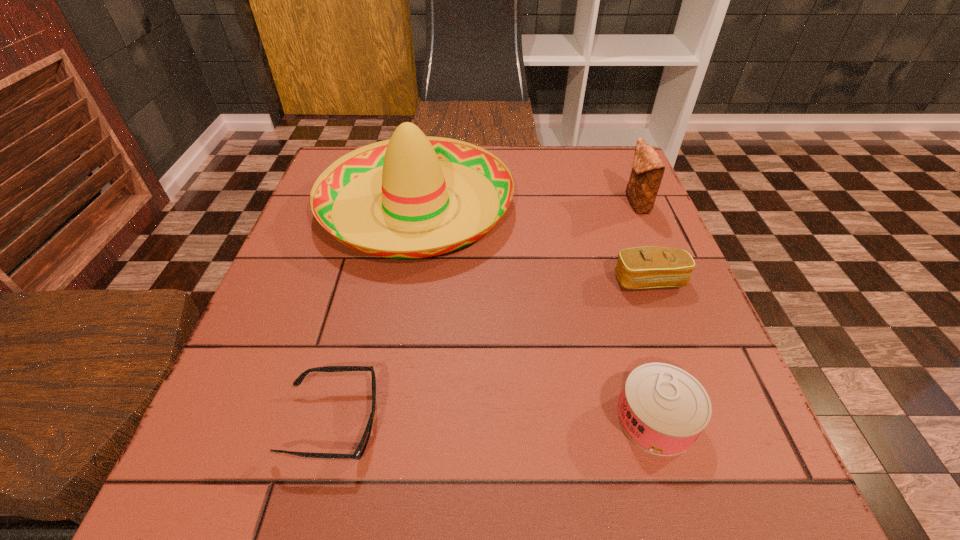
At what (x,y) coordinates should I click in order to perform the action: click on object at the far left corner. Please return your answer as a coordinate pair (x, y). Looking at the image, I should click on (x=414, y=173).

The width and height of the screenshot is (960, 540). I want to click on object present at the near left corner, so click(359, 452).

Locate an element on the screen. object positioned at the far right corner is located at coordinates (647, 172).

The height and width of the screenshot is (540, 960). I want to click on object that is at the near right corner, so click(x=663, y=409).

Image resolution: width=960 pixels, height=540 pixels. Identify the location of vacant space at the far edge. (567, 164).

In the image, there is a desktop. Where is `free region at the left edge`? This screenshot has height=540, width=960. free region at the left edge is located at coordinates (285, 257).

Image resolution: width=960 pixels, height=540 pixels. What are the coordinates of `vacant space at the right edge of the desktop` in the screenshot? It's located at (628, 222).

Find the location of a particular element. This screenshot has width=960, height=540. blank space at the near left corner is located at coordinates (242, 455).

What are the coordinates of `vacant area at the near right corner` in the screenshot? It's located at (708, 458).

The height and width of the screenshot is (540, 960). I want to click on free space that is in between the tallest object and the shorter clutch bag, so click(533, 243).